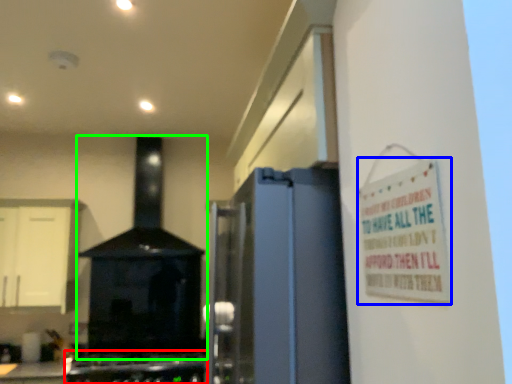
Question: Based on their relative distances, which object is farther from gas stove (highlighted by a red box)? Choose from warning sign (highlighted by a blue box) and home appliance (highlighted by a green box).

Choices:
 (A) warning sign
 (B) home appliance

Answer: (A)